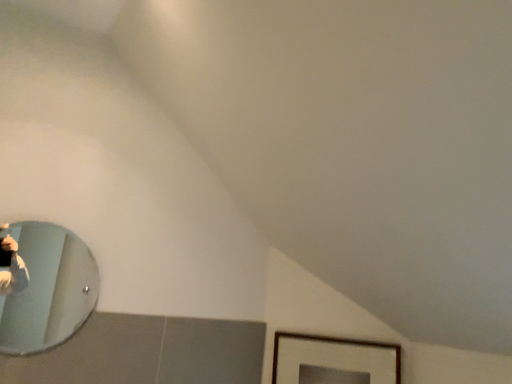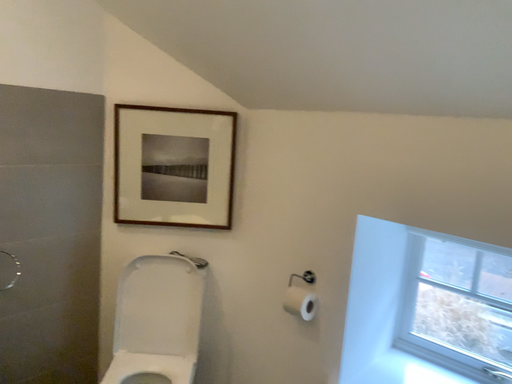
Question: Which way did the camera rotate in the video?

Choices:
 (A) rotated upward
 (B) rotated downward

Answer: (B)